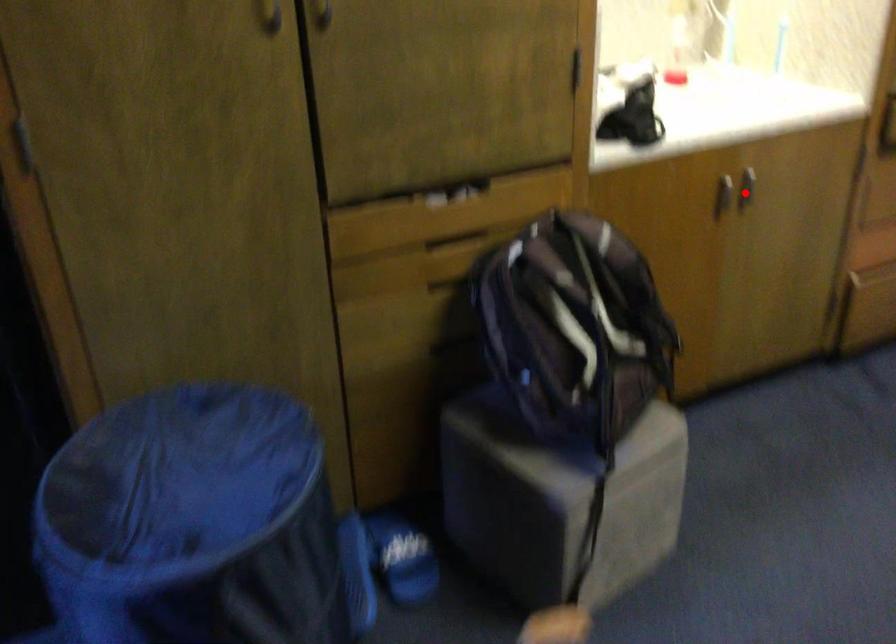
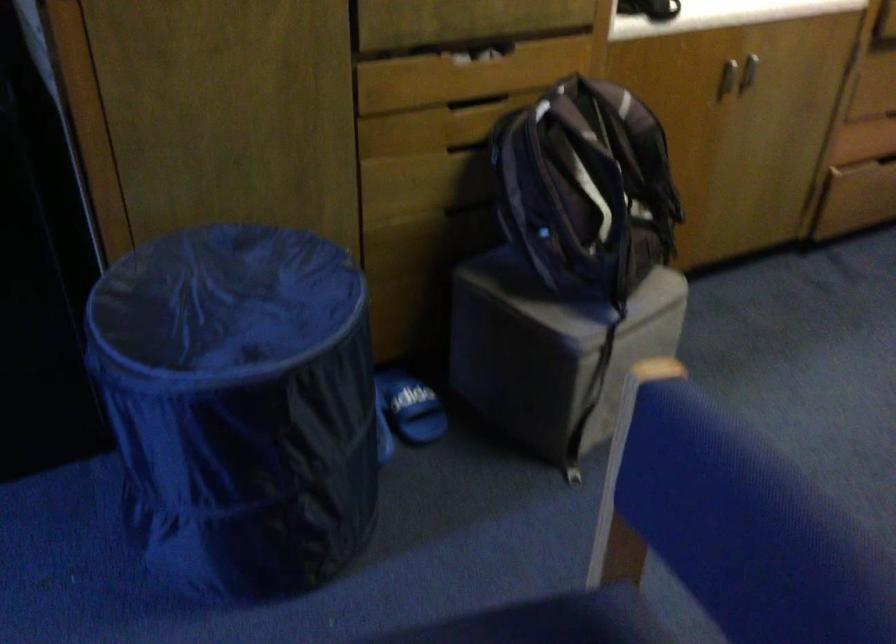
In the second image, find the point that corresponds to the highlighted location in the first image.

(748, 71)